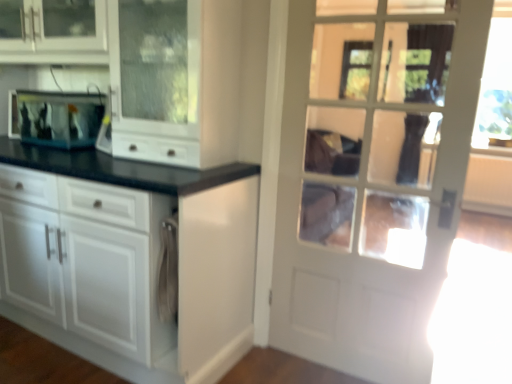
Question: Is white glass door at upper right at the left side of white glossy cabinet at center?

Choices:
 (A) no
 (B) yes

Answer: (A)

Question: Considering the relative sizes of white glass door at upper right and white glossy cabinet at center in the image provided, is white glass door at upper right smaller than white glossy cabinet at center?

Choices:
 (A) yes
 (B) no

Answer: (A)

Question: Considering the relative positions of white glass door at upper right and white glossy cabinet at center in the image provided, is white glass door at upper right in front of white glossy cabinet at center?

Choices:
 (A) yes
 (B) no

Answer: (B)

Question: Can you confirm if white glass door at upper right is wider than white glossy cabinet at center?

Choices:
 (A) no
 (B) yes

Answer: (A)

Question: Is white glossy cabinet at center completely or partially inside white glass door at upper right?

Choices:
 (A) yes
 (B) no

Answer: (B)

Question: Is point (415, 127) closer or farther from the camera than point (223, 233)?

Choices:
 (A) closer
 (B) farther

Answer: (B)

Question: Considering the positions of white glass door at upper right and white glossy cabinet at center in the image, is white glass door at upper right wider or thinner than white glossy cabinet at center?

Choices:
 (A) wide
 (B) thin

Answer: (B)

Question: Is white glass door at upper right to the left or to the right of white glossy cabinet at center in the image?

Choices:
 (A) left
 (B) right

Answer: (B)

Question: From a real-world perspective, relative to white glossy cabinet at center, is white glass door at upper right vertically above or below?

Choices:
 (A) above
 (B) below

Answer: (B)

Question: Considering the positions of white glossy cabinet at center and white glass door at upper right in the image, is white glossy cabinet at center wider or thinner than white glass door at upper right?

Choices:
 (A) wide
 (B) thin

Answer: (A)

Question: Is white glossy cabinet at center taller or shorter than white glass door at upper right?

Choices:
 (A) tall
 (B) short

Answer: (A)

Question: Does point (189, 236) appear closer or farther from the camera than point (358, 119)?

Choices:
 (A) closer
 (B) farther

Answer: (A)

Question: Is white glossy cabinet at center spatially inside white glass door at upper right, or outside of it?

Choices:
 (A) inside
 (B) outside

Answer: (B)

Question: From the image's perspective, is white glass door at upper right located above or below clear glass fish tank at left?

Choices:
 (A) below
 (B) above

Answer: (A)

Question: Relative to clear glass fish tank at left, is white glass door at upper right in front or behind?

Choices:
 (A) front
 (B) behind

Answer: (A)